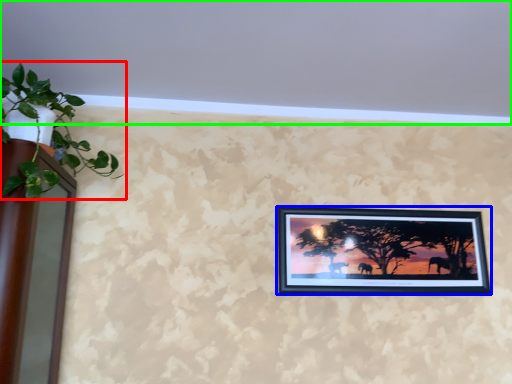
Question: Which object is the farthest from houseplant (highlighted by a red box)? Choose among these: picture frame (highlighted by a blue box) or backdrop (highlighted by a green box).

Choices:
 (A) picture frame
 (B) backdrop

Answer: (A)